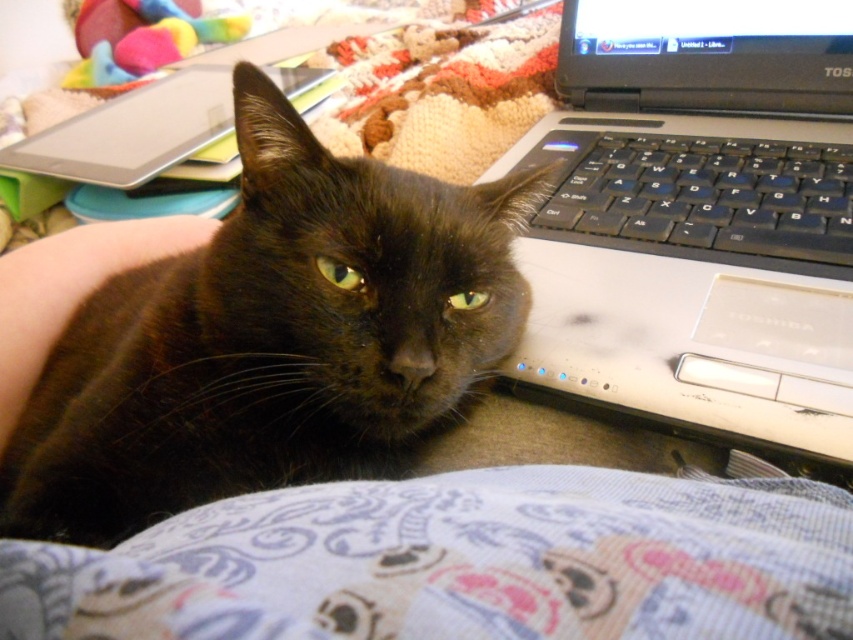
Question: Observing the image, what is the correct spatial positioning of silver metallic laptop at center in reference to black plastic keyboard at right?

Choices:
 (A) below
 (B) above

Answer: (A)

Question: Which of the following is the closest to the observer?

Choices:
 (A) (144, 362)
 (B) (712, 257)
 (C) (169, 54)
 (D) (840, 454)

Answer: (D)

Question: Which object appears closest to the camera in this image?

Choices:
 (A) black glossy cat at upper left
 (B) black plastic keyboard at right
 (C) soft plush toy at upper left

Answer: (A)

Question: Does silver metallic laptop at center have a greater width compared to black plastic keyboard at right?

Choices:
 (A) yes
 (B) no

Answer: (A)

Question: Which of the following is the farthest from the observer?

Choices:
 (A) soft plush toy at upper left
 (B) silver metallic laptop at center
 (C) black glossy cat at upper left
 (D) black plastic keyboard at right

Answer: (A)

Question: Is silver metallic laptop at center positioned at the back of black plastic keyboard at right?

Choices:
 (A) yes
 (B) no

Answer: (B)